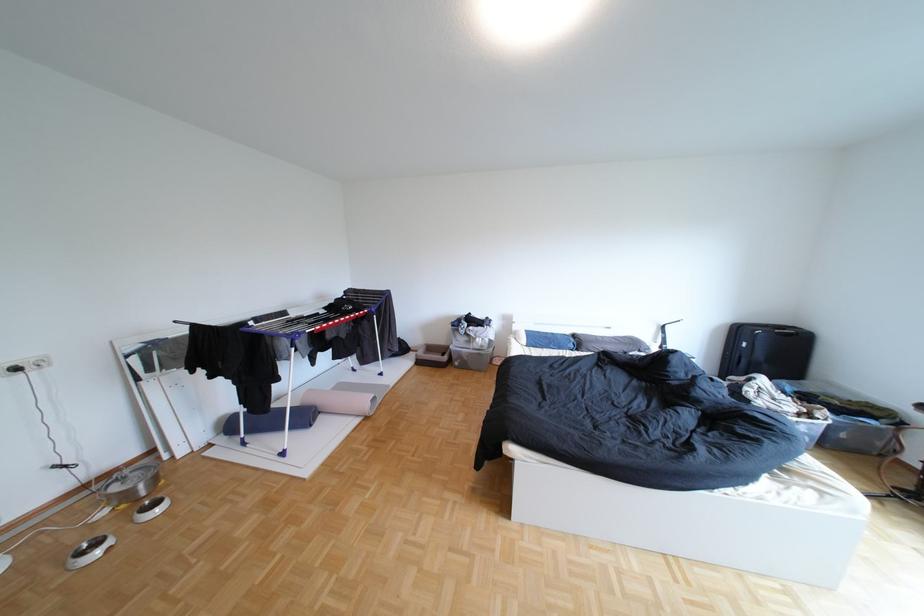
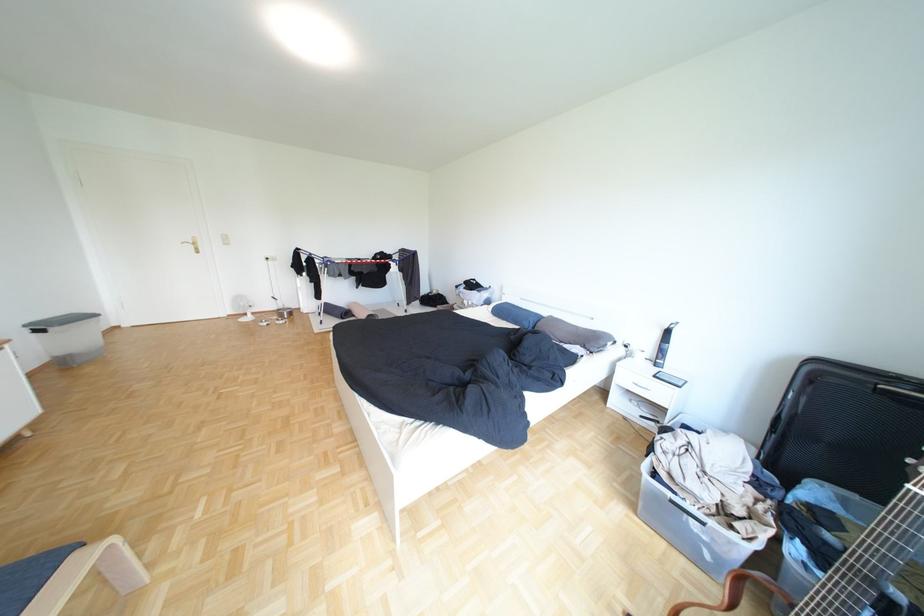
Locate, in the second image, the point that corresponds to point (590, 336) in the first image.

(564, 318)